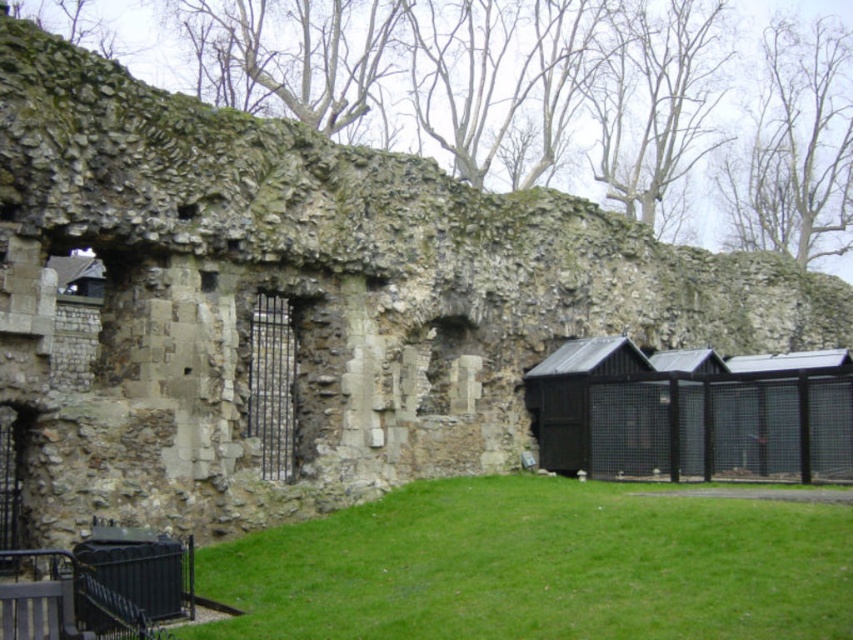
You are a visitor standing in front of the historical stone structure. You see the green grass at lower center and the black metal hut at right. Which object is closer to you from your current position?

The green grass at lower center is closer to you because it is located below the black metal hut at right, meaning it is positioned in front of the hut.

You are standing in front of the historical stone structure. You see the green grass at lower center and the black metal hut at right. Which object is positioned to the left of the other?

The green grass at lower center is positioned to the left of the black metal hut at right according to the description.

You are standing in front of the historical stone structure and want to place a small garden ornament on the green grass at lower center. What are the exact coordinates where you should place it?

The exact coordinates for placing the small garden ornament on the green grass at lower center are at point (538, 566).